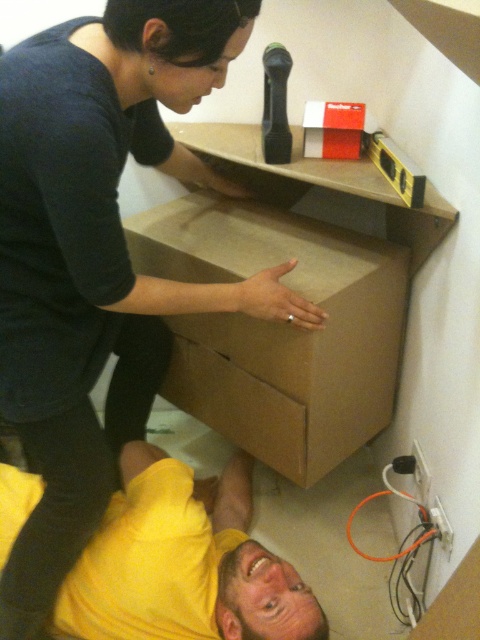
You are organizing a storage area and need to move the brown cardboard box at center and the yellow matte shirt at lower left. According to the scene, which object is positioned to the right side?

The brown cardboard box at center is positioned to the right of the yellow matte shirt at lower left, so the brown cardboard box at center is on the right side.

From the picture: You are a photographer setting up for a photoshoot in the scene described. You need to place a spotlight so that it illuminates both the matte black shirt at upper left and the yellow matte shirt at lower left without casting shadows over the other. Based on their positions, where should you position the spotlight relative to the two shirts?

The matte black shirt at upper left is positioned on the right side of yellow matte shirt at lower left. To avoid casting shadows between them, the spotlight should be placed to the left of both shirts, ensuring light reaches both areas without obstruction.

You are a delivery person who just delivered a brown cardboard box at center to a customer. The customer says they need to place it next to the yellow matte shirt at lower left. The minimum distance required between items is 18 inches for safety. Can you confirm if the current placement meets the safety requirement?

The brown cardboard box at center is 16.99 inches from the yellow matte shirt at lower left, which is less than the required 18 inches. Therefore, the current placement does not meet the safety requirement. Please adjust the position to ensure at least 18 inches of distance between them.